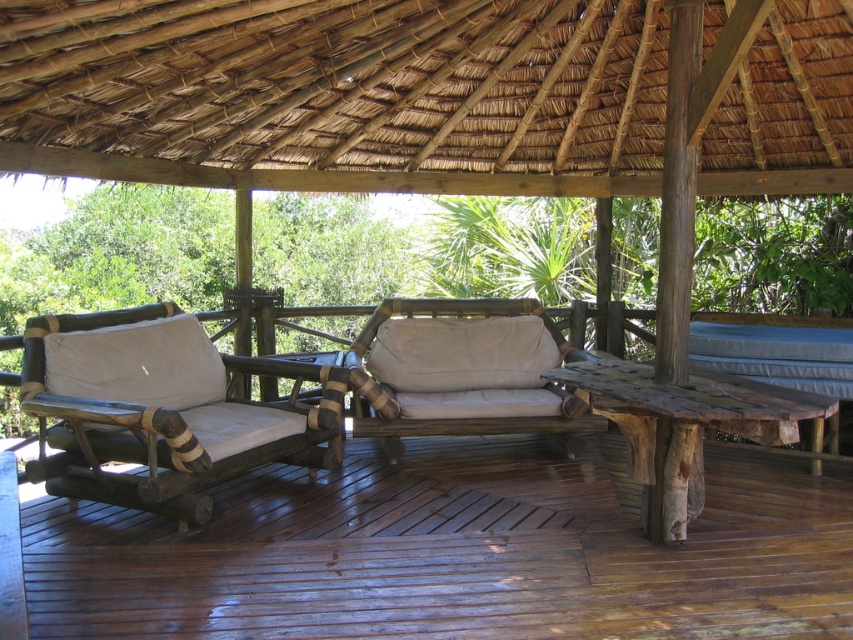
Question: Considering the relative positions of beige fabric couch at center and blue fabric cushion at right in the image provided, where is beige fabric couch at center located with respect to blue fabric cushion at right?

Choices:
 (A) above
 (B) below

Answer: (B)

Question: Is natural wood armchair at left thinner than beige fabric cushion at center?

Choices:
 (A) no
 (B) yes

Answer: (A)

Question: Which object appears farthest from the camera in this image?

Choices:
 (A) natural wood armchair at left
 (B) beige fabric couch at center
 (C) beige fabric cushion at center
 (D) brown wooden deck at center

Answer: (C)

Question: Is beige fabric couch at center to the right of blue fabric cushion at right from the viewer's perspective?

Choices:
 (A) yes
 (B) no

Answer: (B)

Question: Which object is farther from the camera taking this photo?

Choices:
 (A) beige fabric cushion at center
 (B) blue fabric cushion at right
 (C) beige fabric couch at center

Answer: (A)

Question: Which object is closer to the camera taking this photo?

Choices:
 (A) beige fabric cushion at center
 (B) brown wooden deck at center

Answer: (B)